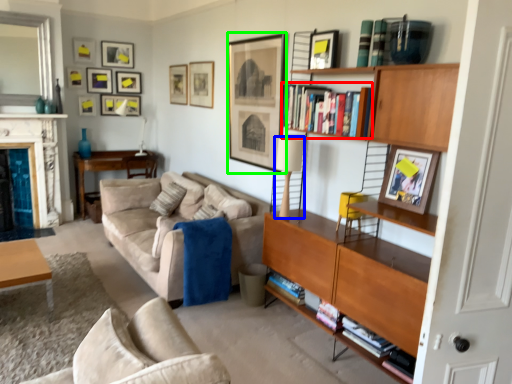
Question: Which object is the farthest from book (highlighted by a red box)? Choose among these: lamp (highlighted by a blue box) or picture frame (highlighted by a green box).

Choices:
 (A) lamp
 (B) picture frame

Answer: (B)